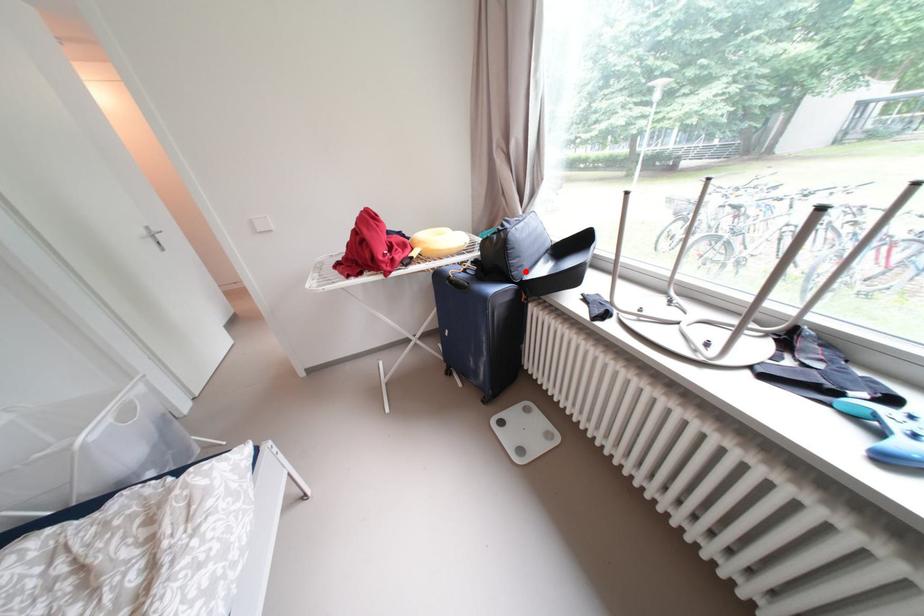
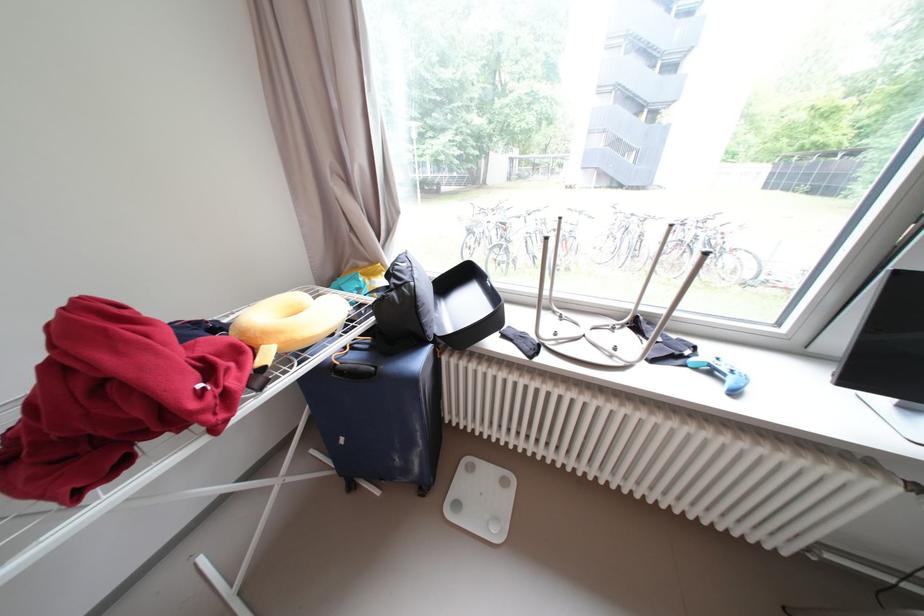
In the second image, find the point that corresponds to the highlighted location in the first image.

(439, 328)